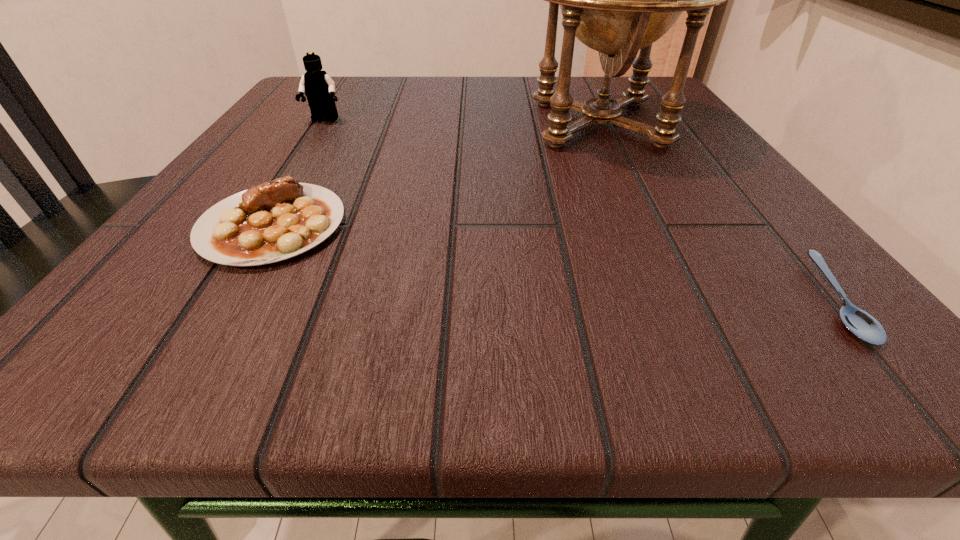
The image size is (960, 540). In order to click on globe in this screenshot , I will do `click(617, 0)`.

The image size is (960, 540). I want to click on the second tallest object, so click(x=319, y=88).

Identify the location of the third tallest object. (272, 221).

The width and height of the screenshot is (960, 540). In order to click on soupspoon in this screenshot , I will do `click(863, 325)`.

Locate an element on the screen. The image size is (960, 540). vacant space positioned on the front-facing side of the globe is located at coordinates (466, 123).

You are a GUI agent. You are given a task and a screenshot of the screen. Output one action in this format:
    pyautogui.click(x=<x>, y=<y>)
    Task: Click on the free space located 0.110m on the front-facing side of the globe
    
    Given the screenshot: What is the action you would take?
    pyautogui.click(x=454, y=123)

Locate an element on the screen. vacant space located 0.100m on the front-facing side of the globe is located at coordinates 460,123.

Locate an element on the screen. The image size is (960, 540). free space located on the front-facing side of the third shortest object is located at coordinates (247, 240).

The height and width of the screenshot is (540, 960). Find the location of `free space located on the back of the steak`. free space located on the back of the steak is located at coordinates (342, 110).

Where is `free spot located on the back of the soupspoon`? The width and height of the screenshot is (960, 540). free spot located on the back of the soupspoon is located at coordinates (681, 117).